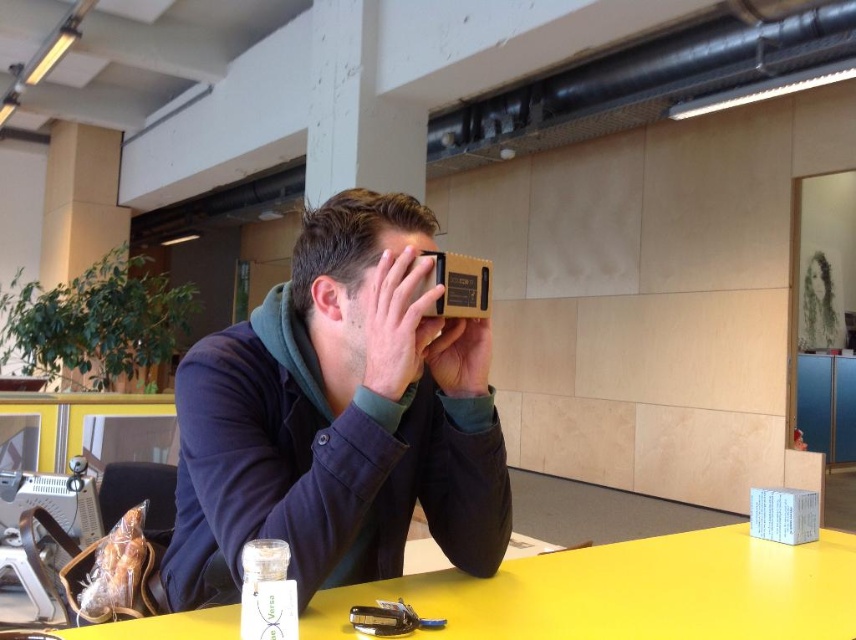
Question: Can you confirm if matte cardboard vr viewer at center is thinner than matte cardboard box at center?

Choices:
 (A) yes
 (B) no

Answer: (B)

Question: Which of the following is the closest to the observer?

Choices:
 (A) (391, 310)
 (B) (795, 573)
 (C) (317, 225)
 (D) (455, 387)

Answer: (A)

Question: Among these points, which one is nearest to the camera?

Choices:
 (A) (663, 612)
 (B) (456, 500)

Answer: (A)

Question: Does matte cardboard box at center have a larger size compared to matte brown cardboard at center?

Choices:
 (A) yes
 (B) no

Answer: (A)

Question: Which object is farther from the camera taking this photo?

Choices:
 (A) matte brown cardboard at center
 (B) matte cardboard vr viewer at center

Answer: (A)

Question: Is matte cardboard vr viewer at center thinner than matte black cardboard at center?

Choices:
 (A) yes
 (B) no

Answer: (B)